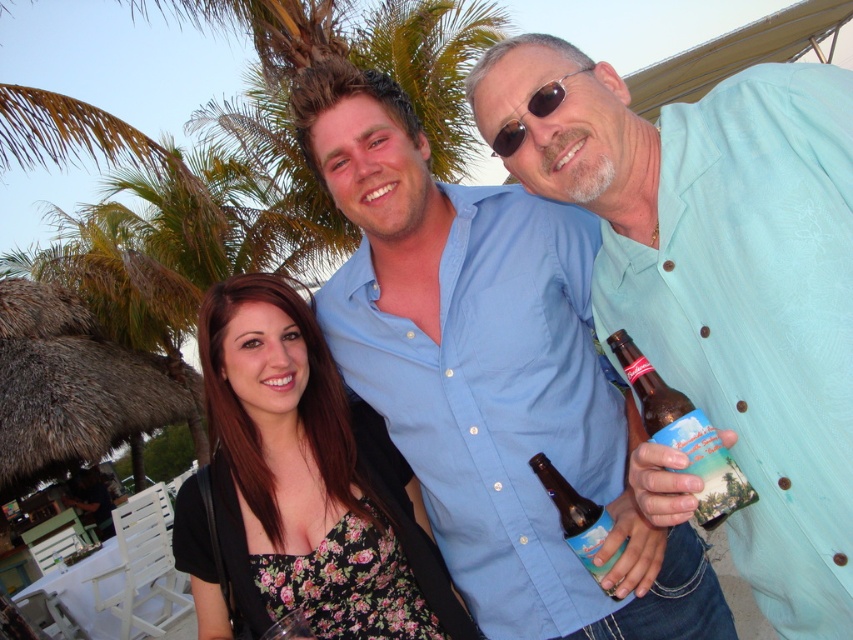
You are a photographer trying to capture the perfect shot of the light blue shirt at center and sunglasses at center. Based on their positions, which object should you focus on first if you want to ensure both are in the frame without moving the camera?

The light blue shirt at center is below sunglasses at center, so you should focus on the sunglasses at center first to ensure both are in the frame without moving the camera.